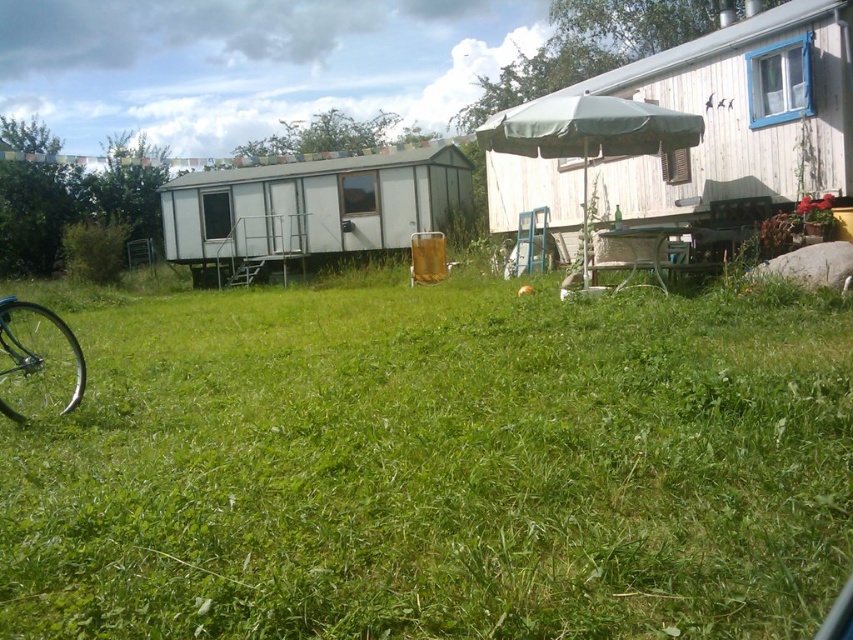
Question: Does green grassy at center come behind shiny silver bicycle wheel at lower left?

Choices:
 (A) no
 (B) yes

Answer: (A)

Question: Based on their relative distances, which object is nearer to the shiny silver bicycle wheel at lower left?

Choices:
 (A) green grassy at center
 (B) green fabric umbrella at center-right

Answer: (A)

Question: Is green fabric umbrella at center-right to the left of shiny silver bicycle wheel at lower left from the viewer's perspective?

Choices:
 (A) no
 (B) yes

Answer: (A)

Question: Which object appears farthest from the camera in this image?

Choices:
 (A) shiny silver bicycle wheel at lower left
 (B) green fabric umbrella at center-right

Answer: (B)

Question: Which point appears farthest from the camera in this image?

Choices:
 (A) (54, 332)
 (B) (549, 141)

Answer: (B)

Question: Is green grassy at center closer to the viewer compared to white matte trailer at center?

Choices:
 (A) no
 (B) yes

Answer: (B)